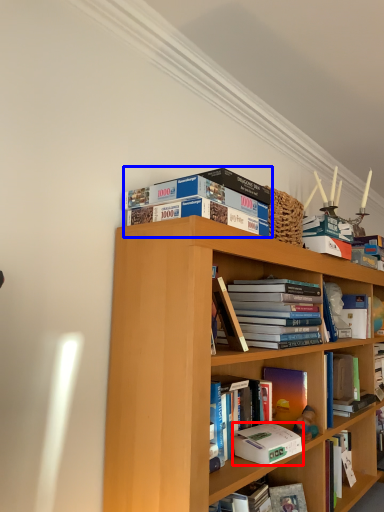
Question: Among these objects, which one is nearest to the camera, paperback book (highlighted by a red box) or book (highlighted by a blue box)?

Choices:
 (A) paperback book
 (B) book

Answer: (B)